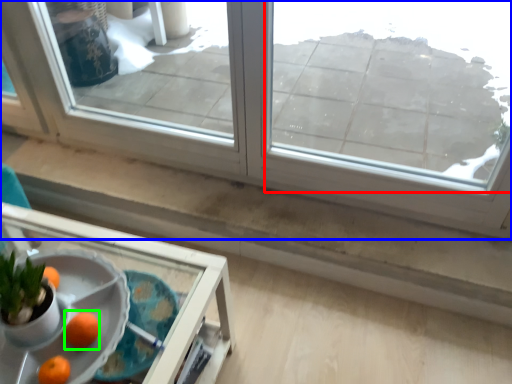
Question: Which object is positioned closest to window (highlighted by a red box)? Select from window (highlighted by a blue box) and orange (highlighted by a green box).

Choices:
 (A) window
 (B) orange

Answer: (A)